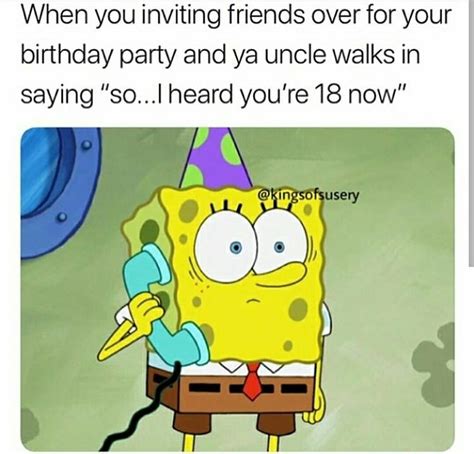
Locate an element on the screen. The width and height of the screenshot is (474, 454). metal window frame is located at coordinates (81, 183).